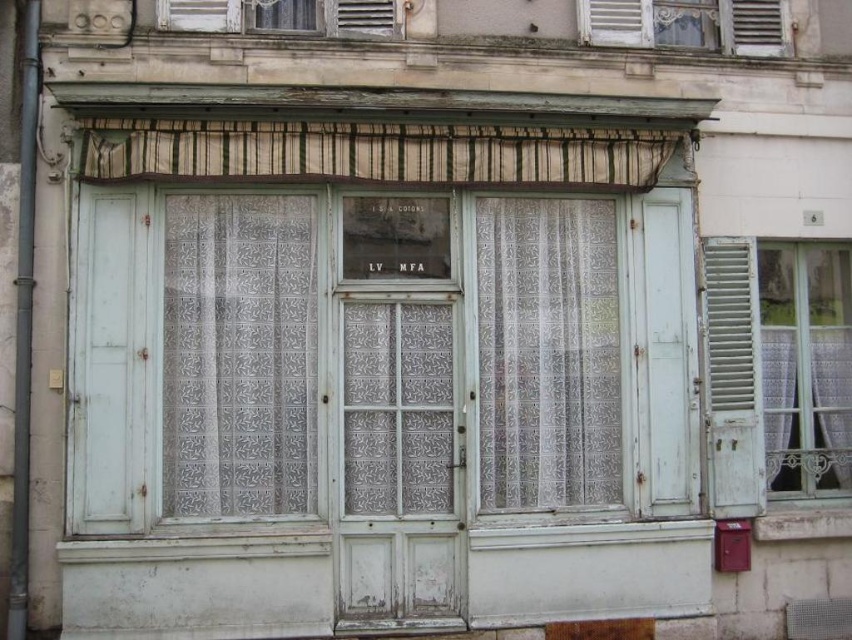
You are standing in front of the building facade and notice the white lace curtain at left. Where exactly is it located on the facade?

The white lace curtain at left is located at point 0.555 on the horizontal axis and 0.282 on the vertical axis.

You are an interior designer assessing the building facade. You notice the white lace curtain at center and the white painted wood at upper right. Which object has a smaller width?

The white lace curtain at center has a smaller width than the white painted wood at upper right.

You are standing at the base of the building facade and want to hang a decorative wreath between the white lace curtain at center and the white painted wood at upper right. How far apart are these two elements to ensure proper placement?

The white lace curtain at center is 5.36 feet away from the white painted wood at upper right, so you should place the wreath approximately halfway between them at around 2.68 feet from each element.